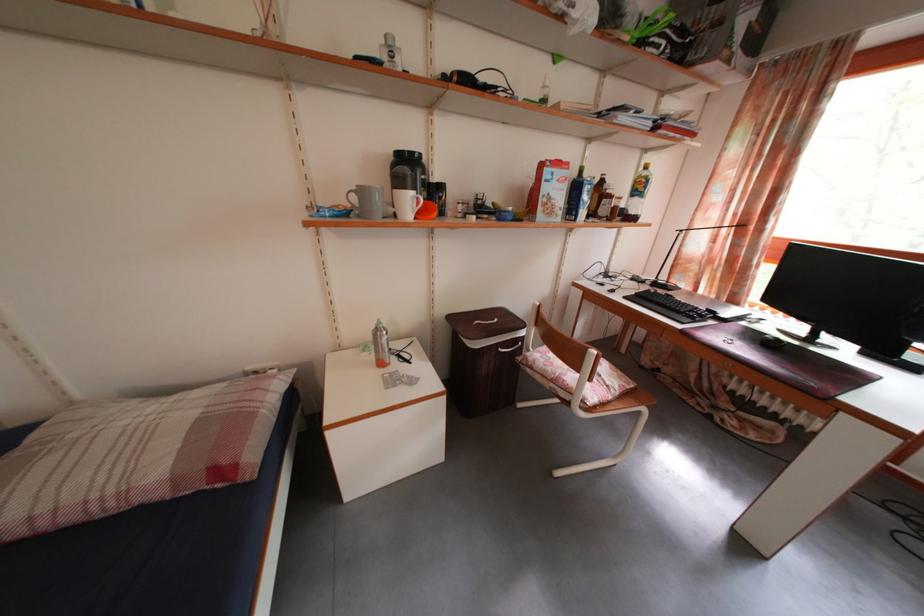
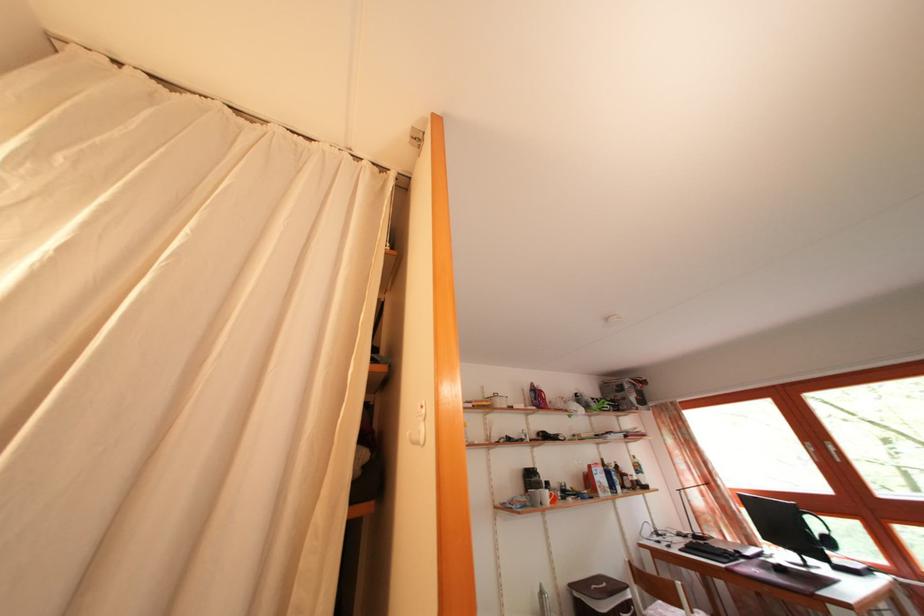
The point at (624, 200) is marked in the first image. Where is the corresponding point in the second image?

(636, 480)